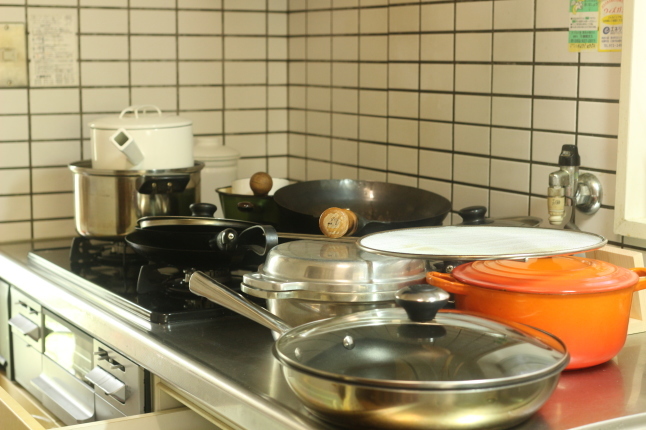
The height and width of the screenshot is (430, 646). Find the location of `stovetop`. stovetop is located at coordinates (107, 274).